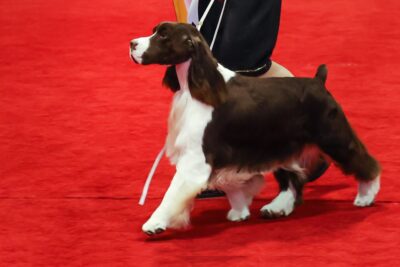
This screenshot has height=267, width=400. What are the coordinates of `white chest` in the screenshot? It's located at [x=180, y=117].